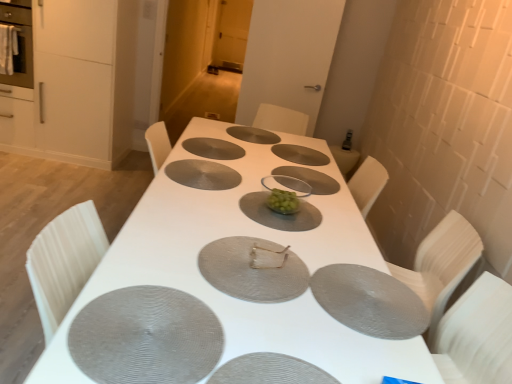
Identify the location of vacant space in front of silver textured pizza pan at center, the 1th pizza pan in the back-to-front sequence. Image resolution: width=512 pixels, height=384 pixels. (260, 146).